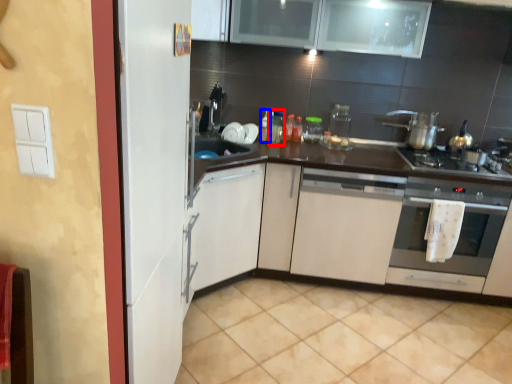
Question: Among these objects, which one is nearest to the camera, bottle (highlighted by a red box) or bottle (highlighted by a blue box)?

Choices:
 (A) bottle
 (B) bottle

Answer: (B)